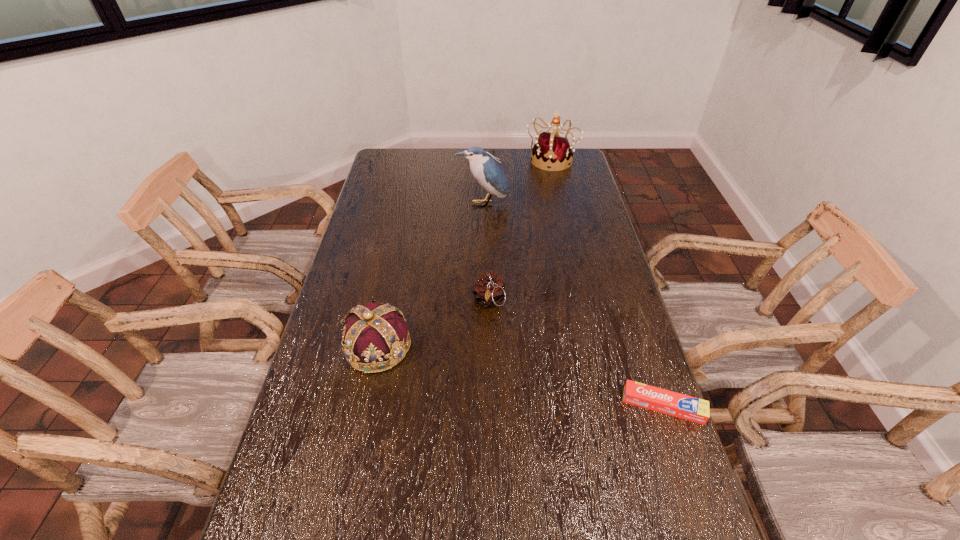
Locate an element on the screen. Image resolution: width=960 pixels, height=540 pixels. free location that satisfies the following two spatial constraints: 1. on the back side of the crown; 2. on the right side of the second farthest object is located at coordinates (407, 204).

What are the coordinates of `free location that satisfies the following two spatial constraints: 1. on the front side of the crown; 2. on the left side of the nearest object` in the screenshot? It's located at (366, 406).

Identify the location of free region that satisfies the following two spatial constraints: 1. on the front side of the shortest object; 2. on the right side of the bird. (485, 406).